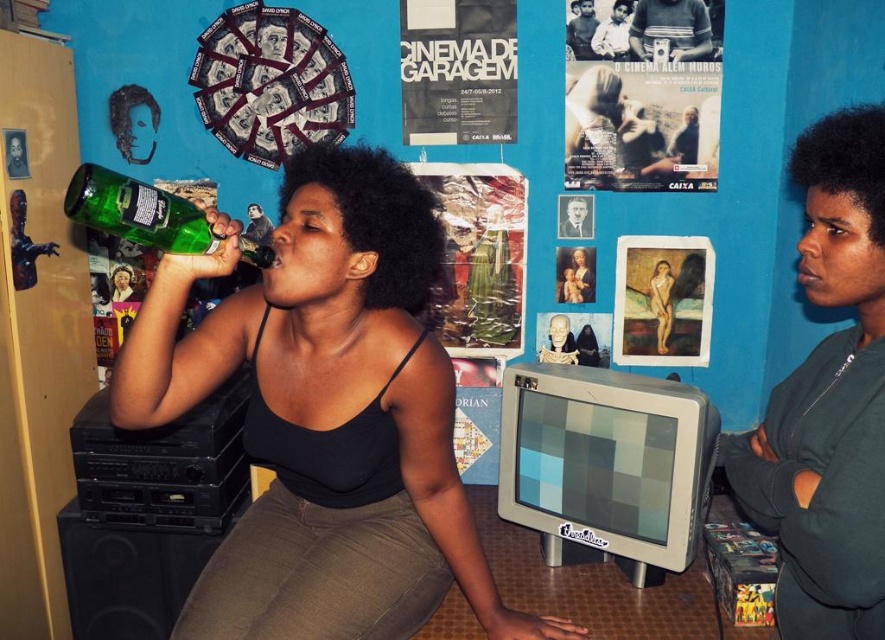
Between smooth skin nude at center and smooth plastic bottle at upper left, which one appears on the left side from the viewer's perspective?

Positioned to the left is smooth plastic bottle at upper left.

Does smooth skin nude at center have a greater height compared to smooth plastic bottle at upper left?

Indeed, smooth skin nude at center has a greater height compared to smooth plastic bottle at upper left.

Locate an element on the screen. smooth skin nude at center is located at coordinates (660, 301).

Where is `smooth skin nude at center`? This screenshot has height=640, width=885. smooth skin nude at center is located at coordinates (660, 301).

Can you confirm if light brown wooden chair at upper center is wider than matte black tank top at center?

Indeed, light brown wooden chair at upper center has a greater width compared to matte black tank top at center.

Does light brown wooden chair at upper center have a greater height compared to matte black tank top at center?

Yes.

Who is more distant from viewer, (x=612, y=45) or (x=135, y=300)?

The point (x=135, y=300) is behind.

This screenshot has height=640, width=885. I want to click on light brown wooden chair at upper center, so 613,33.

Is black paper portrait at upper center to the left of smooth plastic bottle at upper left from the viewer's perspective?

No, black paper portrait at upper center is not to the left of smooth plastic bottle at upper left.

Which is below, black paper portrait at upper center or smooth plastic bottle at upper left?

smooth plastic bottle at upper left is below.

What do you see at coordinates (575, 216) in the screenshot? This screenshot has height=640, width=885. I see `black paper portrait at upper center` at bounding box center [575, 216].

At what (x,y) coordinates should I click in order to perform the action: click on black paper portrait at upper center. Please return your answer as a coordinate pair (x, y). Looking at the image, I should click on (575, 216).